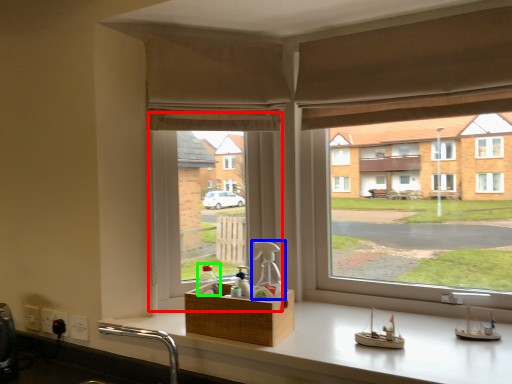
Question: Estimate the real-world distances between objects in this image. Which object is farther from window screen (highlighted by a red box), bottle (highlighted by a blue box) or bottle (highlighted by a green box)?

Choices:
 (A) bottle
 (B) bottle

Answer: (A)